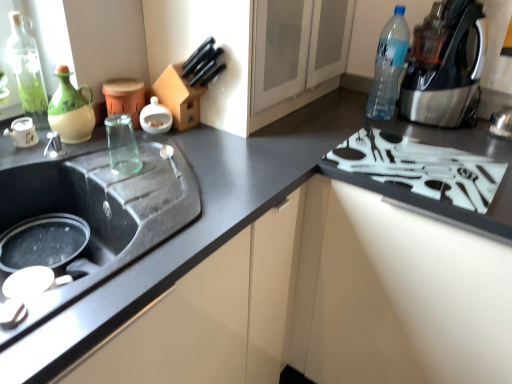
You are a GUI agent. You are given a task and a screenshot of the screen. Output one action in this format:
    pyautogui.click(x=<x>, y=<y>)
    Task: Click on the vacant area situated below white plastic gas stove at right (from a real-world perspective)
    
    Given the screenshot: What is the action you would take?
    pyautogui.click(x=414, y=162)